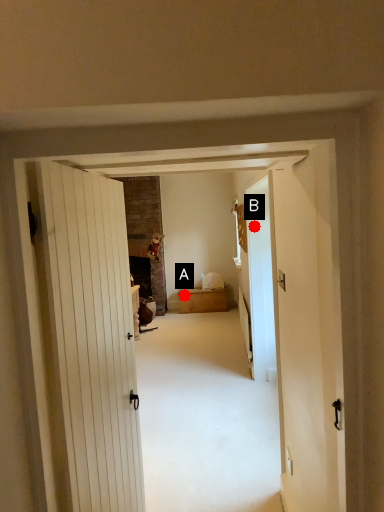
Question: Two points are circled on the image, labeled by A and B beside each circle. Which point is farther to the camera?

Choices:
 (A) A is further
 (B) B is further

Answer: (A)